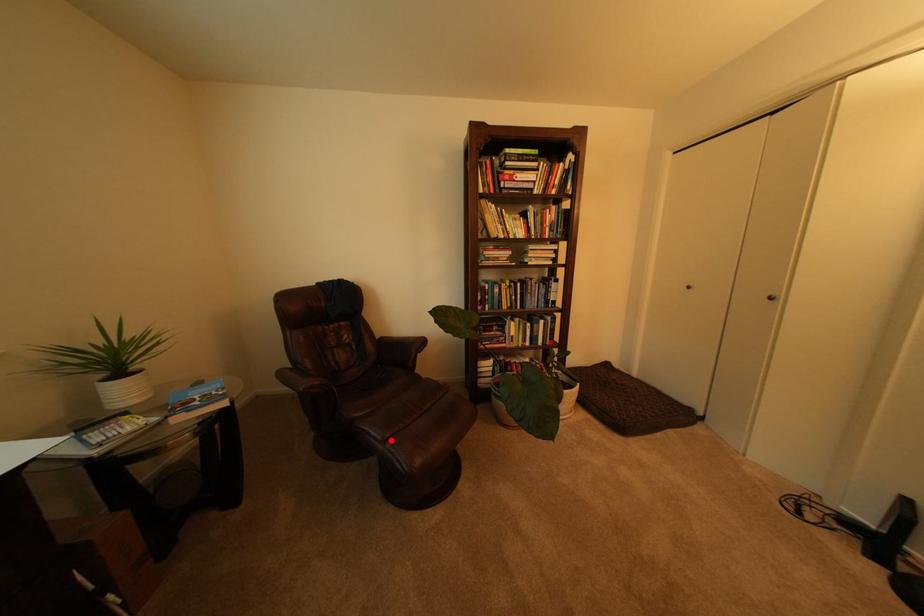
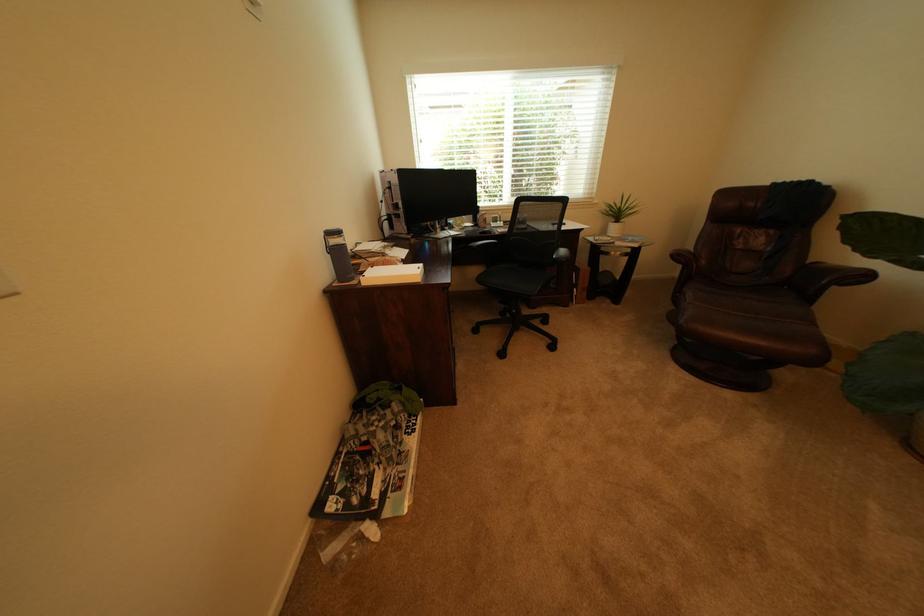
The point at the highlighted location is marked in the first image. Where is the corresponding point in the second image?

(699, 302)